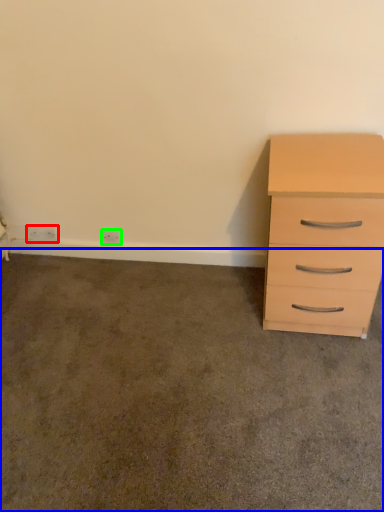
Question: Based on their relative distances, which object is nearer to electric outlet (highlighted by a red box)? Choose from concrete (highlighted by a blue box) and electric outlet (highlighted by a green box).

Choices:
 (A) concrete
 (B) electric outlet

Answer: (B)